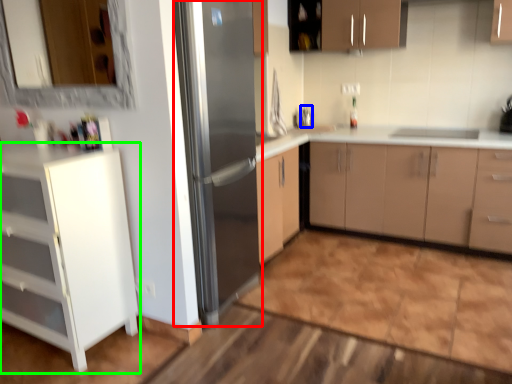
Question: Which object is positioned farthest from refrigerator (highlighted by a red box)? Select from faucet (highlighted by a blue box) and cabinetry (highlighted by a green box).

Choices:
 (A) faucet
 (B) cabinetry

Answer: (A)